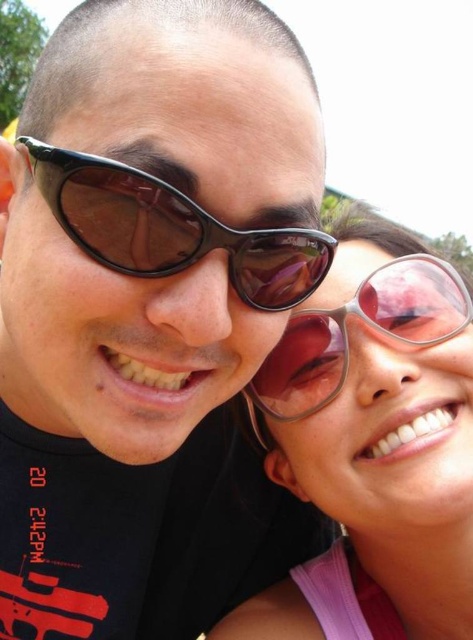
Question: Is matte black sunglasses at center positioned at the back of pink translucent sunglasses at center?

Choices:
 (A) no
 (B) yes

Answer: (A)

Question: Among these points, which one is nearest to the camera?

Choices:
 (A) (64, 211)
 (B) (396, 348)

Answer: (A)

Question: Based on their relative distances, which object is farther from the pink translucent sunglasses at center?

Choices:
 (A) pink reflective sunglasses at right
 (B) matte black sunglasses at center
 (C) black plastic sunglasses at center

Answer: (C)

Question: Can you confirm if pink reflective sunglasses at right is positioned below pink translucent sunglasses at center?

Choices:
 (A) no
 (B) yes

Answer: (B)

Question: Does matte black sunglasses at center lie in front of pink reflective sunglasses at right?

Choices:
 (A) yes
 (B) no

Answer: (A)

Question: Which point appears closest to the camera in this image?

Choices:
 (A) (73, 493)
 (B) (315, 346)

Answer: (B)